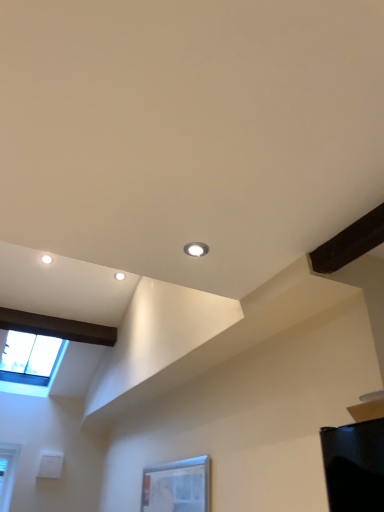
You are a GUI agent. You are given a task and a screenshot of the screen. Output one action in this format:
    pyautogui.click(x=<x>, y=<y>)
    Task: Click on the transparent glass window at lower center, the second window when ordered from back to front
    
    Given the screenshot: What is the action you would take?
    pyautogui.click(x=177, y=486)

The image size is (384, 512). I want to click on matte white droplight at upper center, so click(196, 249).

Locate an element on the screen. Image resolution: width=384 pixels, height=512 pixels. transparent glass window at lower center, the second window when ordered from back to front is located at coordinates (177, 486).

Which point is more forward, [203,253] or [6,355]?

Positioned in front is point [203,253].

Can you confirm if matte white droplight at upper center is smaller than transparent glass window at upper left, placed as the 1th window when sorted from back to front?

Yes, matte white droplight at upper center is smaller than transparent glass window at upper left, placed as the 1th window when sorted from back to front.

Between matte white droplight at upper center and transparent glass window at upper left, which ranks as the 2th window in right-to-left order, which one has smaller width?

With smaller width is matte white droplight at upper center.

Is matte white droplight at upper center further to the viewer compared to transparent glass window at upper left, which ranks as the 2th window in right-to-left order?

No, it is not.

Between transparent glass window at lower center, the second window when ordered from back to front, and transparent glass window at upper left, which appears as the 2th window when viewed from the front, which one has less height?

Standing shorter between the two is transparent glass window at lower center, the second window when ordered from back to front.

Which point is more distant from viewer, (156, 492) or (30, 357)?

The point (30, 357) is more distant.

How many degrees apart are the facing directions of transparent glass window at upper left, placed as the 1th window when sorted from back to front, and matte white droplight at upper center?

The facing directions of transparent glass window at upper left, placed as the 1th window when sorted from back to front, and matte white droplight at upper center are 173 degrees apart.

Who is bigger, transparent glass window at upper left, placed as the 1th window when sorted from back to front, or matte white droplight at upper center?

transparent glass window at upper left, placed as the 1th window when sorted from back to front, is bigger.

Would you say transparent glass window at upper left, which appears as the 2th window when viewed from the front, is inside or outside matte white droplight at upper center?

transparent glass window at upper left, which appears as the 2th window when viewed from the front, is outside matte white droplight at upper center.

How distant is transparent glass window at upper left, placed as the 1th window when sorted from back to front, from transparent glass window at lower center, placed as the first window when sorted from right to left?

They are 2.14 meters apart.

Does point (33, 388) appear closer or farther from the camera than point (192, 461)?

Point (33, 388) appears to be farther away from the viewer than point (192, 461).

Can you see transparent glass window at upper left, placed as the 1th window when sorted from back to front, touching transparent glass window at lower center, the second window when ordered from back to front?

transparent glass window at upper left, placed as the 1th window when sorted from back to front, and transparent glass window at lower center, the second window when ordered from back to front, are clearly separated.

Is the depth of transparent glass window at lower center, placed as the first window when sorted from right to left, greater than that of matte white droplight at upper center?

Yes, the depth of transparent glass window at lower center, placed as the first window when sorted from right to left, is greater than that of matte white droplight at upper center.

From a real-world perspective, is transparent glass window at lower center, which ranks as the 2th window in left-to-right order, physically located above or below matte white droplight at upper center?

In terms of real-world spatial position, transparent glass window at lower center, which ranks as the 2th window in left-to-right order, is below matte white droplight at upper center.

From the image's perspective, is transparent glass window at lower center, the second window when ordered from back to front, on matte white droplight at upper center?

No.

Is transparent glass window at lower center, the second window when ordered from back to front, facing away from matte white droplight at upper center?

transparent glass window at lower center, the second window when ordered from back to front, is not turned away from matte white droplight at upper center.

Locate an element on the screen. Image resolution: width=384 pixels, height=512 pixels. droplight in front of the transparent glass window at lower center, which is the 1th window in front-to-back order is located at coordinates 196,249.

Which of these two, matte white droplight at upper center or transparent glass window at lower center, which is the 1th window in front-to-back order, is bigger?

With larger size is transparent glass window at lower center, which is the 1th window in front-to-back order.

Consider the image. Is matte white droplight at upper center facing towards transparent glass window at lower center, the second window when ordered from back to front?

No.

In the image, there is a transparent glass window at upper left, which ranks as the 2th window in right-to-left order. Where is `droplight above it (from the image's perspective)`? The width and height of the screenshot is (384, 512). droplight above it (from the image's perspective) is located at coordinates (196, 249).

Find the location of `window lying on the right of transparent glass window at upper left, which ranks as the 2th window in right-to-left order`. window lying on the right of transparent glass window at upper left, which ranks as the 2th window in right-to-left order is located at coordinates (177, 486).

From the image, which object appears to be farther from transparent glass window at lower center, placed as the first window when sorted from right to left, matte white droplight at upper center or transparent glass window at upper left, the 1th window from the left?

The object further to transparent glass window at lower center, placed as the first window when sorted from right to left, is transparent glass window at upper left, the 1th window from the left.

Based on their spatial positions, is transparent glass window at lower center, placed as the first window when sorted from right to left, or matte white droplight at upper center further from transparent glass window at upper left, which appears as the 2th window when viewed from the front?

matte white droplight at upper center is positioned further to the anchor transparent glass window at upper left, which appears as the 2th window when viewed from the front.

Estimate the real-world distances between objects in this image. Which object is closer to transparent glass window at lower center, which is the 1th window in front-to-back order, transparent glass window at upper left, placed as the 1th window when sorted from back to front, or matte white droplight at upper center?

The object closer to transparent glass window at lower center, which is the 1th window in front-to-back order, is matte white droplight at upper center.

From the image, which object appears to be farther from matte white droplight at upper center, transparent glass window at lower center, the second window when ordered from back to front, or transparent glass window at upper left, which ranks as the 2th window in right-to-left order?

transparent glass window at upper left, which ranks as the 2th window in right-to-left order, is positioned further to the anchor matte white droplight at upper center.

Looking at the image, which one is located closer to transparent glass window at upper left, which ranks as the 2th window in right-to-left order, matte white droplight at upper center or transparent glass window at lower center, placed as the first window when sorted from right to left?

The object closer to transparent glass window at upper left, which ranks as the 2th window in right-to-left order, is transparent glass window at lower center, placed as the first window when sorted from right to left.

From the image, which object appears to be farther from matte white droplight at upper center, transparent glass window at upper left, which appears as the 2th window when viewed from the front, or transparent glass window at lower center, which is the 1th window in front-to-back order?

The object further to matte white droplight at upper center is transparent glass window at upper left, which appears as the 2th window when viewed from the front.

Locate an element on the screen. window between matte white droplight at upper center and transparent glass window at upper left, which ranks as the 2th window in right-to-left order, in the front-back direction is located at coordinates (177, 486).